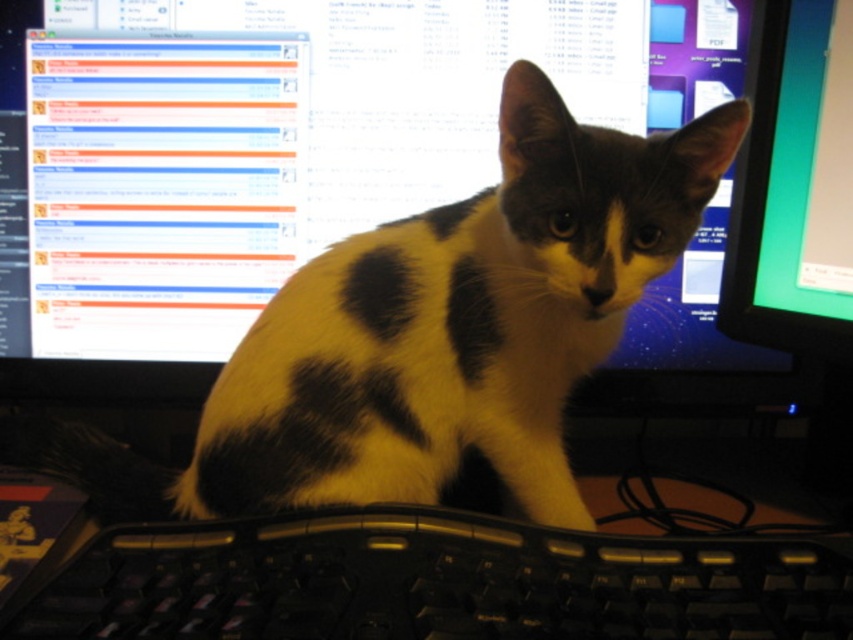
Which is behind, point (334, 275) or point (376, 547)?

The point (334, 275) is behind.

Who is shorter, black and white fur cat at center or black plastic keyboard at center?

With less height is black plastic keyboard at center.

This screenshot has height=640, width=853. In order to click on black and white fur cat at center in this screenshot , I will do point(457,323).

Is point (556, 308) behind point (761, 316)?

That is False.

I want to click on black and white fur cat at center, so click(x=457, y=323).

Who is positioned more to the right, black plastic keyboard at center or matte green screen at upper right?

From the viewer's perspective, matte green screen at upper right appears more on the right side.

Can you confirm if black plastic keyboard at center is shorter than matte green screen at upper right?

Yes.

At what (x,y) coordinates should I click in order to perform the action: click on black plastic keyboard at center. Please return your answer as a coordinate pair (x, y). Looking at the image, I should click on (434, 582).

Where is `black plastic keyboard at center`? black plastic keyboard at center is located at coordinates (434, 582).